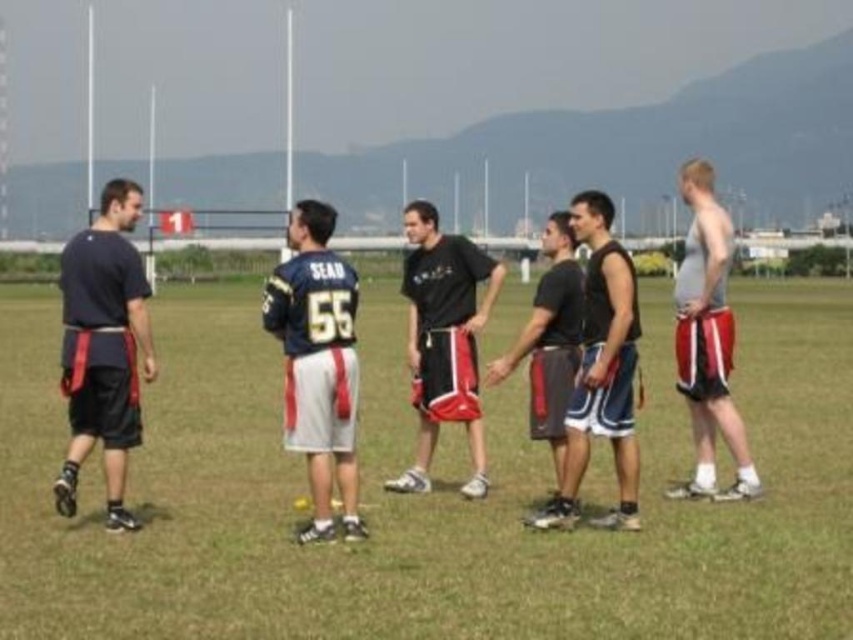
Is dark blue jersey at left positioned before dark gray fabric shorts at center?

Yes.

Can you confirm if dark blue jersey at left is positioned to the left of dark gray fabric shorts at center?

Correct, you'll find dark blue jersey at left to the left of dark gray fabric shorts at center.

Which is in front, point (138, 214) or point (502, 371)?

Positioned in front is point (138, 214).

Where is `dark blue jersey at left`? Image resolution: width=853 pixels, height=640 pixels. dark blue jersey at left is located at coordinates (103, 348).

Is blue jersey at center smaller than dark gray shorts at center?

No.

Is blue jersey at center below dark gray shorts at center?

Yes, blue jersey at center is below dark gray shorts at center.

Locate an element on the screen. This screenshot has height=640, width=853. blue jersey at center is located at coordinates (318, 364).

Is blue jersey at center wider than gray matte shorts at right?

No.

Does blue jersey at center have a lesser height compared to gray matte shorts at right?

Correct, blue jersey at center is not as tall as gray matte shorts at right.

Measure the distance between blue jersey at center and camera.

blue jersey at center and camera are 33.40 feet apart from each other.

Where is `blue jersey at center`? This screenshot has height=640, width=853. blue jersey at center is located at coordinates (318, 364).